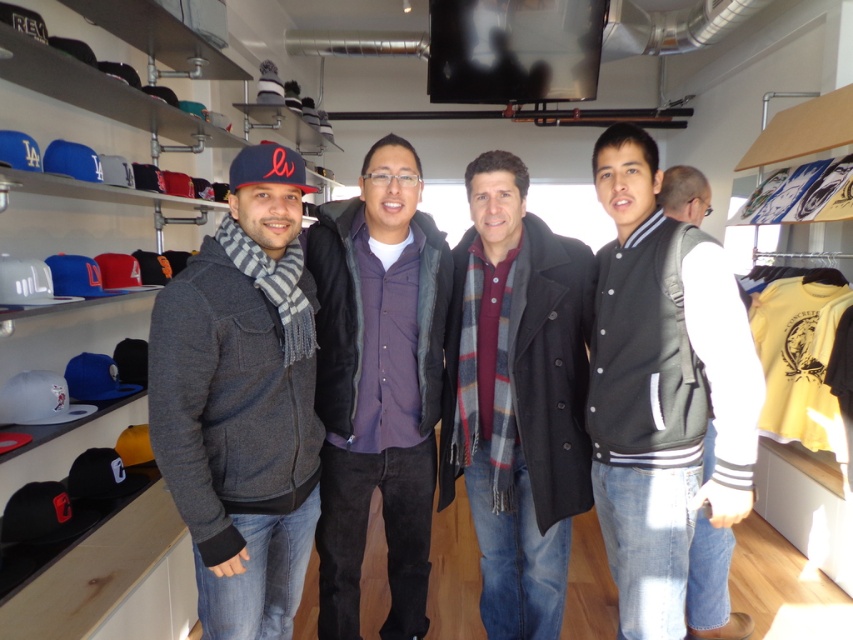
Question: Does black leather jacket at center appear under purple cotton shirt at center?

Choices:
 (A) yes
 (B) no

Answer: (B)

Question: Which point appears farthest from the camera in this image?

Choices:
 (A) (0, 400)
 (B) (12, 371)
 (C) (68, 509)
 (D) (405, 554)

Answer: (B)

Question: Is black matte baseball cap at lower left in front of white matte baseball cap at left?

Choices:
 (A) no
 (B) yes

Answer: (B)

Question: Can you confirm if gray fleece jacket at left is smaller than purple cotton shirt at center?

Choices:
 (A) yes
 (B) no

Answer: (A)

Question: Which point is farther to the camera?

Choices:
 (A) plaid scarf at center
 (B) white matte baseball cap at left
 (C) black leather jacket at center

Answer: (B)

Question: Which of the following is the farthest from the observer?

Choices:
 (A) matte blue baseball cap at left
 (B) black leather jacket at center

Answer: (A)